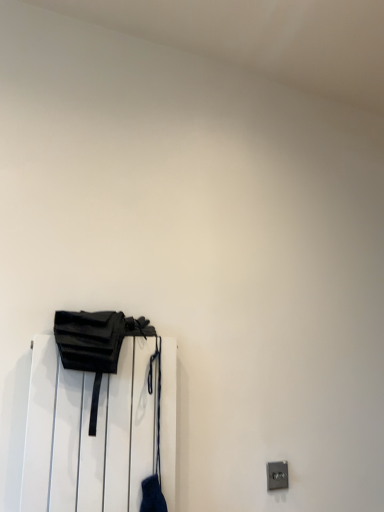
Find the location of a particular element. satin silver switch at lower right is located at coordinates (277, 475).

In order to face satin silver switch at lower right, should I rotate leftwards or rightwards?

To face it directly, rotate right by 11.244 degrees.

The image size is (384, 512). What do you see at coordinates (277, 475) in the screenshot? I see `satin silver switch at lower right` at bounding box center [277, 475].

Locate an element on the screen. This screenshot has height=512, width=384. satin silver switch at lower right is located at coordinates (277, 475).